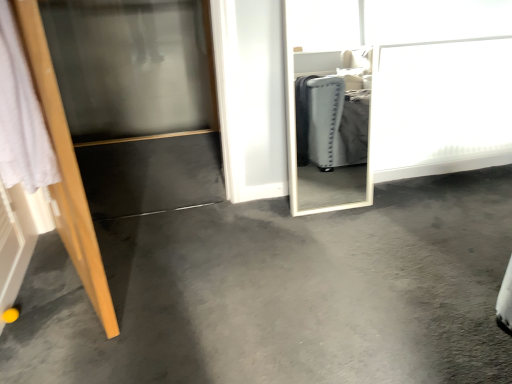
Question: In the image, is wooden door at left positioned in front of or behind gray carpet at center?

Choices:
 (A) front
 (B) behind

Answer: (A)

Question: Would you say wooden door at left is inside or outside gray carpet at center?

Choices:
 (A) outside
 (B) inside

Answer: (A)

Question: Estimate the real-world distances between objects in this image. Which object is farther from the gray carpet at center?

Choices:
 (A) wooden door at left
 (B) transparent glass screen door at left, placed as the 2th screen door when sorted from right to left
 (C) white glossy screen door at upper right, which appears as the 2th screen door when viewed from the left

Answer: (B)

Question: Which object is positioned farthest from the gray carpet at center?

Choices:
 (A) white glossy screen door at upper right, which appears as the 2th screen door when viewed from the left
 (B) wooden door at left
 (C) transparent glass screen door at left, marked as the 1th screen door in a left-to-right arrangement

Answer: (C)